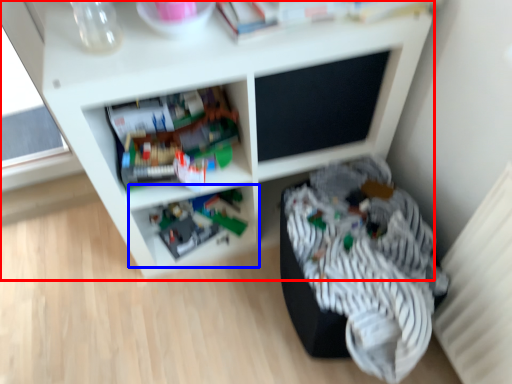
Question: Which point is closer to the camera, shelf (highlighted by a red box) or shelf (highlighted by a blue box)?

Choices:
 (A) shelf
 (B) shelf

Answer: (A)